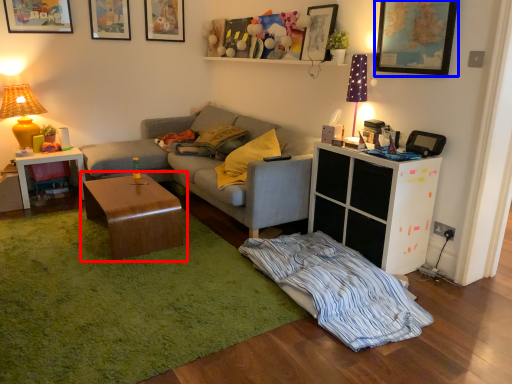
Question: Which of the following is the farthest to the observer, coffee table (highlighted by a red box) or picture frame (highlighted by a blue box)?

Choices:
 (A) coffee table
 (B) picture frame

Answer: (A)